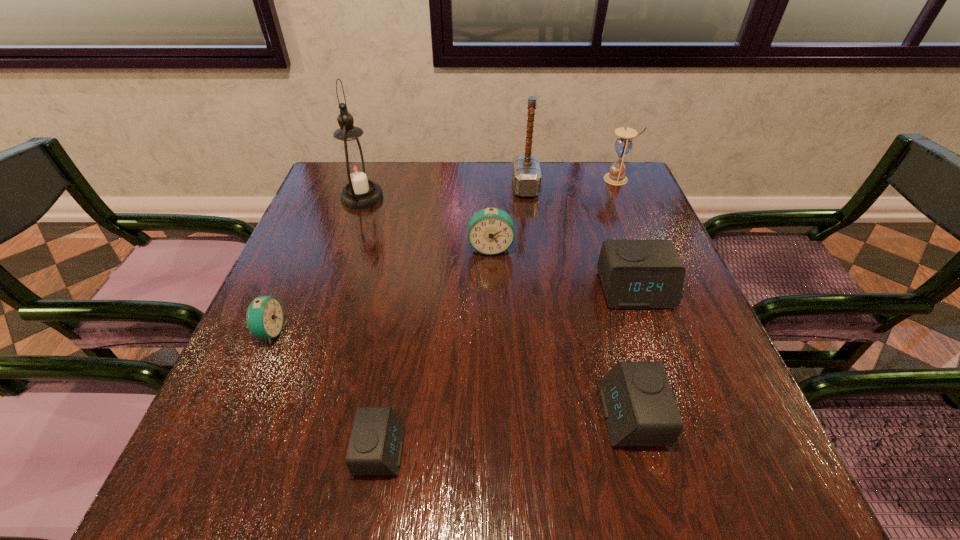
Select which object appears as the third closest to the nearer blue alarm clock. Please provide its 2D coordinates. Your answer should be formatted as a tuple, i.e. [(x, y)], where the tuple contains the x and y coordinates of a point satisfying the conditions above.

[(490, 231)]

Find the location of a particular element. the third closest object to the shortest object is located at coordinates (490, 231).

Where is `alarm clock identified as the third closest to the fourth farthest object`? The image size is (960, 540). alarm clock identified as the third closest to the fourth farthest object is located at coordinates (264, 317).

Identify which alarm clock is located as the fourth nearest to the right blue alarm clock. Please provide its 2D coordinates. Your answer should be formatted as a tuple, i.e. [(x, y)], where the tuple contains the x and y coordinates of a point satisfying the conditions above.

[(375, 448)]

Choose which black alarm clock is the nearest neighbor to the bigger blue alarm clock. Please provide its 2D coordinates. Your answer should be formatted as a tuple, i.e. [(x, y)], where the tuple contains the x and y coordinates of a point satisfying the conditions above.

[(635, 274)]

Identify which black alarm clock is the third closest to the seventh shortest object. Please provide its 2D coordinates. Your answer should be formatted as a tuple, i.e. [(x, y)], where the tuple contains the x and y coordinates of a point satisfying the conditions above.

[(375, 448)]

Identify the location of vacant space that satisfies the following two spatial constraints: 1. on the front-facing side of the biggest black alarm clock; 2. on the front-facing side of the smaller blue alarm clock. Image resolution: width=960 pixels, height=540 pixels. (650, 332).

This screenshot has height=540, width=960. Find the location of `free region that satisfies the following two spatial constraints: 1. on the front-facing side of the farthest black alarm clock; 2. on the front-facing side of the smaller blue alarm clock`. free region that satisfies the following two spatial constraints: 1. on the front-facing side of the farthest black alarm clock; 2. on the front-facing side of the smaller blue alarm clock is located at coordinates (650, 332).

Image resolution: width=960 pixels, height=540 pixels. In order to click on free location that satisfies the following two spatial constraints: 1. on the front-facing side of the fourth tallest object; 2. on the front-facing side of the left blue alarm clock in this screenshot , I will do `click(492, 332)`.

This screenshot has height=540, width=960. Identify the location of free point that satisfies the following two spatial constraints: 1. on the front-facing side of the biggest black alarm clock; 2. on the front-facing side of the leftmost black alarm clock. (691, 449).